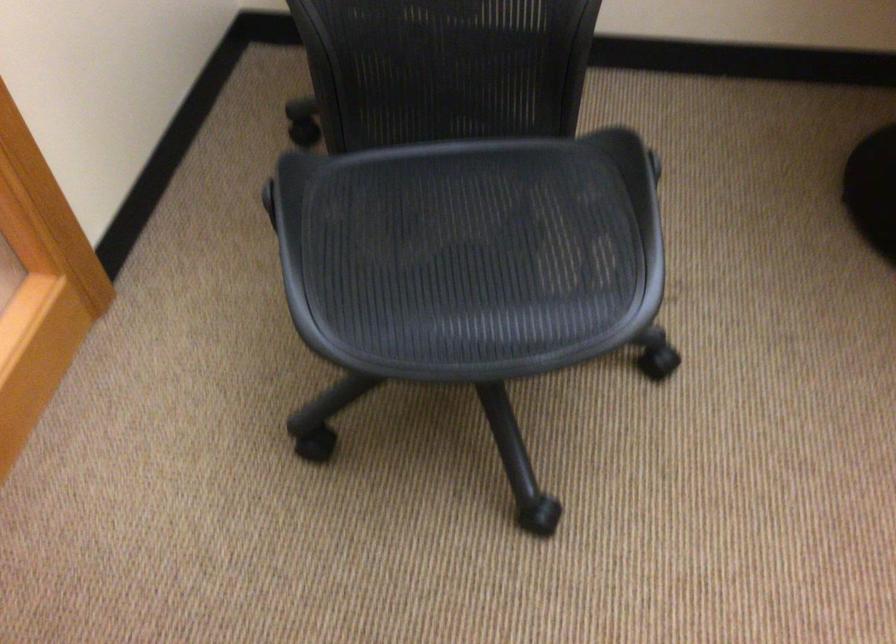
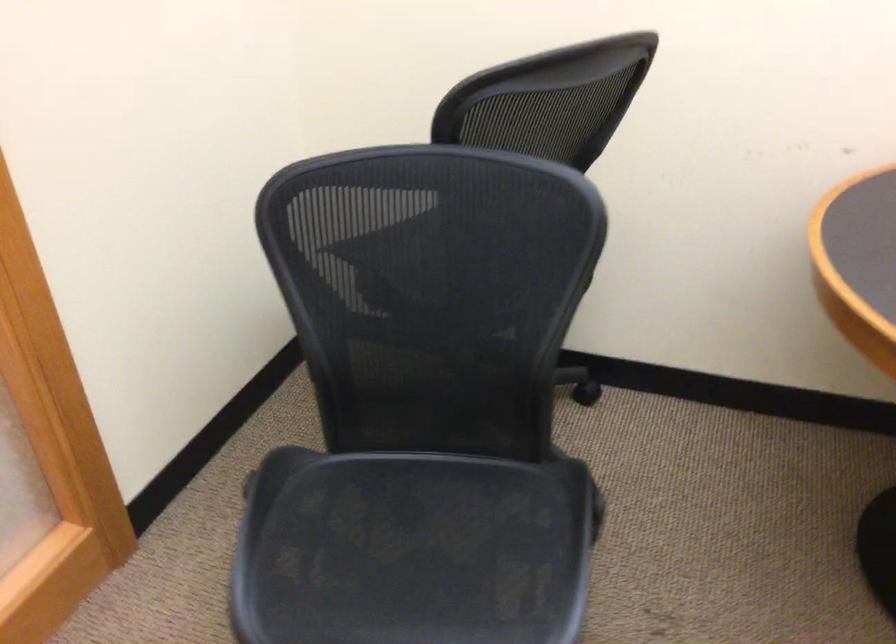
Question: How did the camera likely rotate?

Choices:
 (A) Left
 (B) Right
 (C) Up
 (D) Down

Answer: (C)